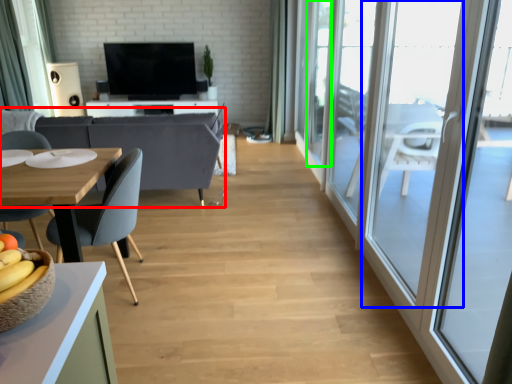
Question: Which object is the closest to the couch (highlighted by a red box)? Choose among these: window (highlighted by a blue box) or window (highlighted by a green box).

Choices:
 (A) window
 (B) window

Answer: (B)